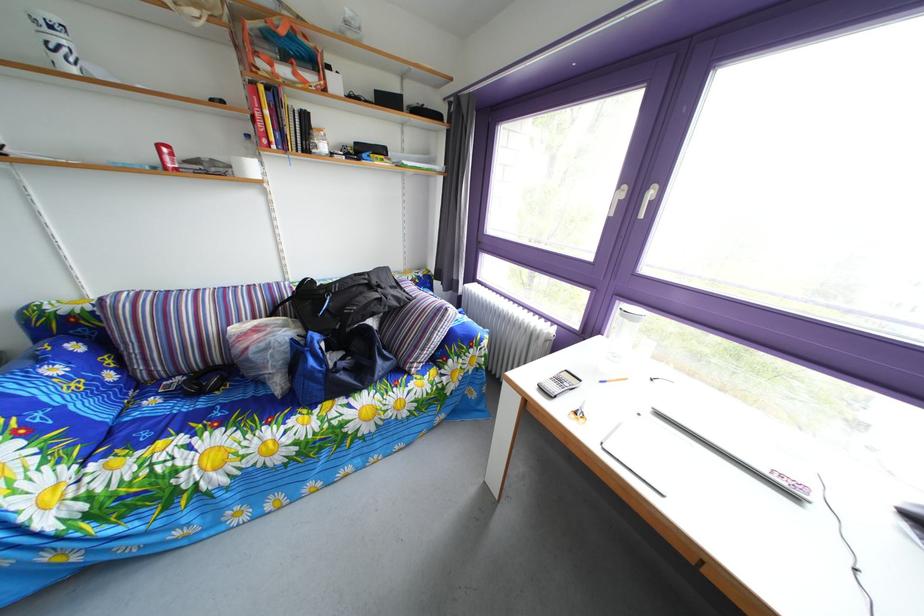
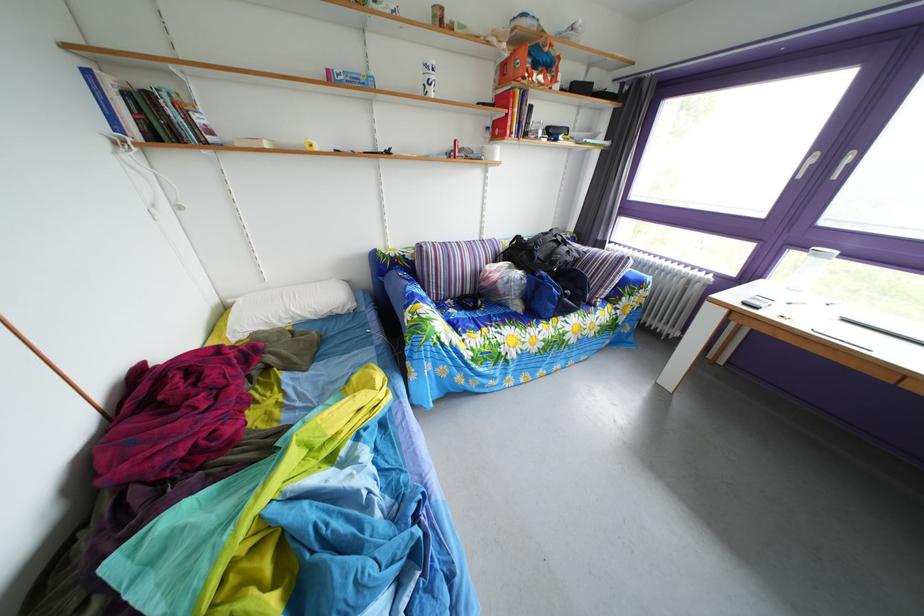
Where in the second image is the point corresponding to the point at 259,145 from the first image?

(499, 137)